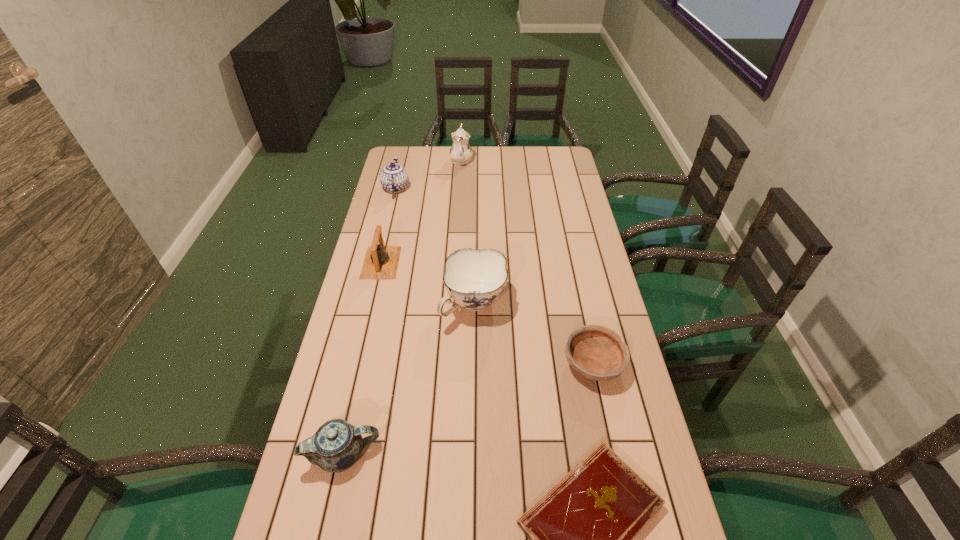
This screenshot has width=960, height=540. What are the coordinates of `object that is the sixth closest to the shortest object` in the screenshot? It's located at (460, 152).

Identify which chinaware is located as the nearest to the third nearest chinaware. Please provide its 2D coordinates. Your answer should be formatted as a tuple, i.e. [(x, y)], where the tuple contains the x and y coordinates of a point satisfying the conditions above.

[(460, 152)]

This screenshot has width=960, height=540. In order to click on chinaware that is the fourth closest one to the notebook in this screenshot , I will do `click(460, 152)`.

This screenshot has width=960, height=540. What are the coordinates of `free space that satisfies the following two spatial constraints: 1. on the front side of the second nearest chinaware; 2. on the right side of the farthest object` in the screenshot? It's located at (453, 304).